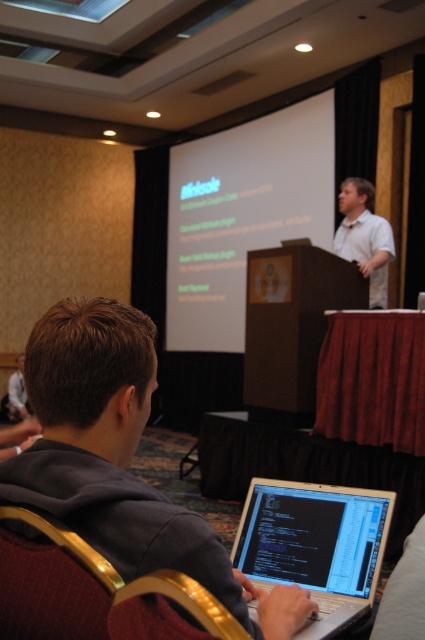
You are standing at the center of the conference room and see two points marked on the floor. The first point is at coordinate point(53, 364) and the second point is at coordinate point(359, 554). Which point is closer to you?

Point(53, 364) is in front of point(359, 554), so it is closer to you.

You are organizing a tech conference and need to ensure that the silver metallic laptop at center and the white shirt at center are visible to all attendees. Given their sizes, which one might require a higher podium to be properly seen?

The white shirt at center is taller than the silver metallic laptop at center, so the white shirt at center might require a higher podium to be properly seen.

You are organizing a photo shoot and need to ensure that the gray hoodie at lower left and the silver metallic laptop at center do not overlap in the final image. Based on their positions and sizes, is it possible to adjust the camera angle so that both objects are fully visible without overlapping?

The gray hoodie at lower left might be wider than silver metallic laptop at center, so adjusting the camera angle to position the gray hoodie slightly to the side or tilt the view could prevent overlap while keeping both in frame.